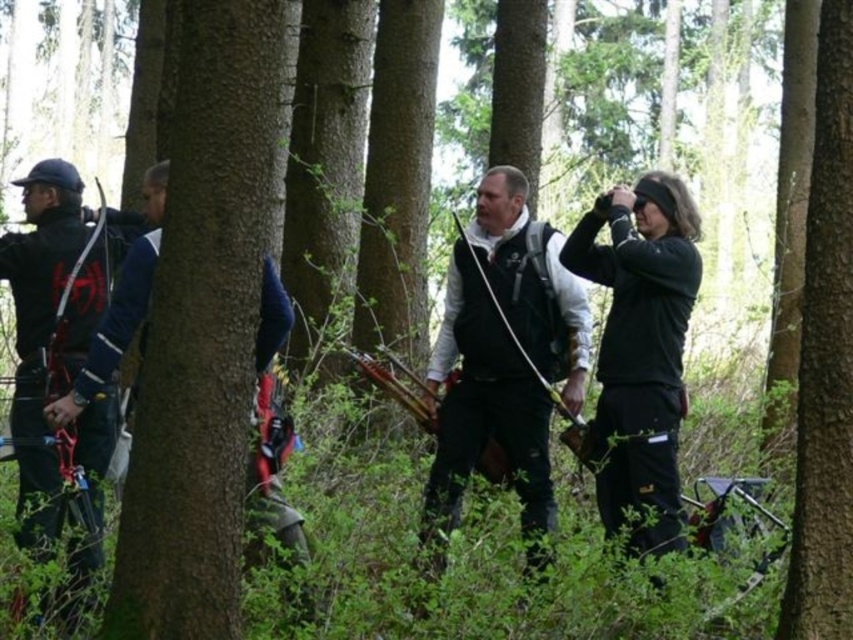
At what (x,y) coordinates should I click in order to perform the action: click on black matte vest at center. Please return your answer as a coordinate pair (x, y). The height and width of the screenshot is (640, 853). Looking at the image, I should click on (485, 412).

Which is in front, point (532, 563) or point (7, 243)?

Point (7, 243) is in front.

Where is `black matte vest at center`? black matte vest at center is located at coordinates (485, 412).

Based on the photo, is smooth bark tree at center closer to camera compared to matte black jacket at left?

Yes, it is in front of matte black jacket at left.

Does smooth bark tree at center have a lesser width compared to matte black jacket at left?

Correct, smooth bark tree at center's width is less than matte black jacket at left's.

Is point (822, 170) behind point (39, 467)?

No, (822, 170) is closer to viewer.

This screenshot has height=640, width=853. Identify the location of smooth bark tree at center. coord(825,358).

Can you confirm if black matte jacket at right is bigger than matte black jacket at left?

Correct, black matte jacket at right is larger in size than matte black jacket at left.

In the scene shown: Between black matte jacket at right and matte black jacket at left, which one is positioned lower?

matte black jacket at left

What are the coordinates of `black matte jacket at right` in the screenshot? It's located at (640, 346).

Find the location of a particular element. black matte jacket at right is located at coordinates (640, 346).